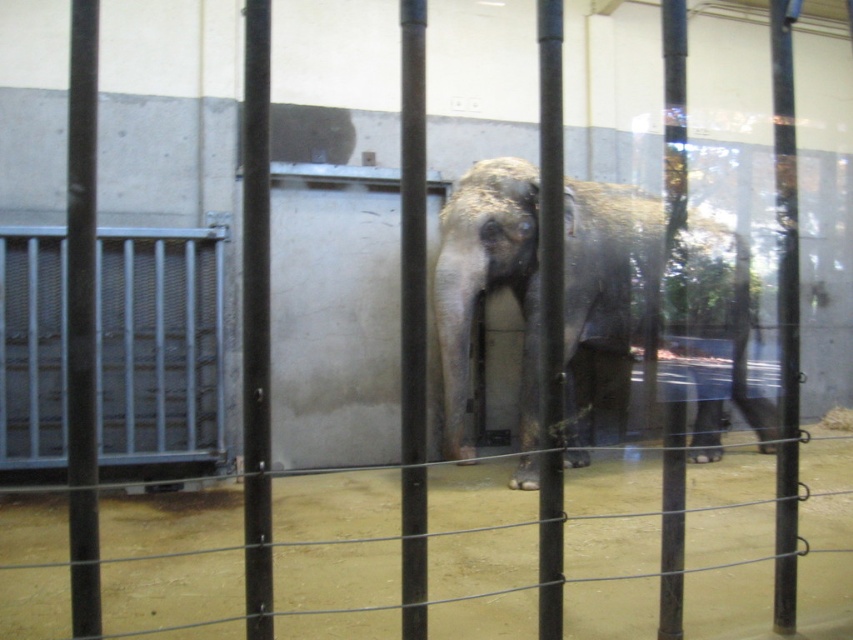
Locate an element on the screen. The height and width of the screenshot is (640, 853). gray textured elephant at center is located at coordinates (486, 284).

Can you confirm if gray textured elephant at center is wider than brushed metal gate at left?

Yes, gray textured elephant at center is wider than brushed metal gate at left.

Image resolution: width=853 pixels, height=640 pixels. Describe the element at coordinates (486, 284) in the screenshot. I see `gray textured elephant at center` at that location.

Where is `gray textured elephant at center`? This screenshot has height=640, width=853. gray textured elephant at center is located at coordinates (486, 284).